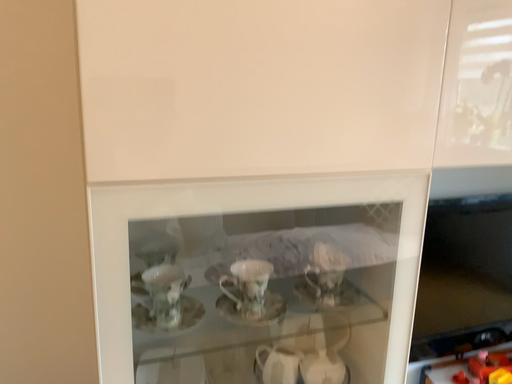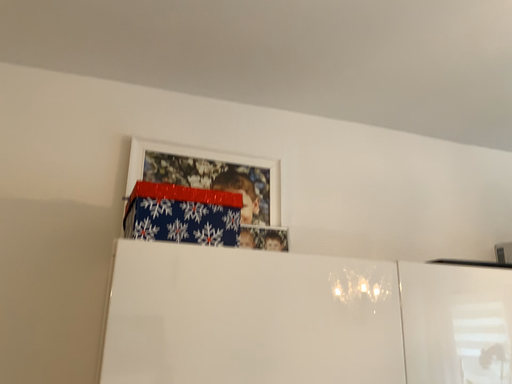
Question: Which way did the camera rotate in the video?

Choices:
 (A) rotated upward
 (B) rotated downward

Answer: (A)